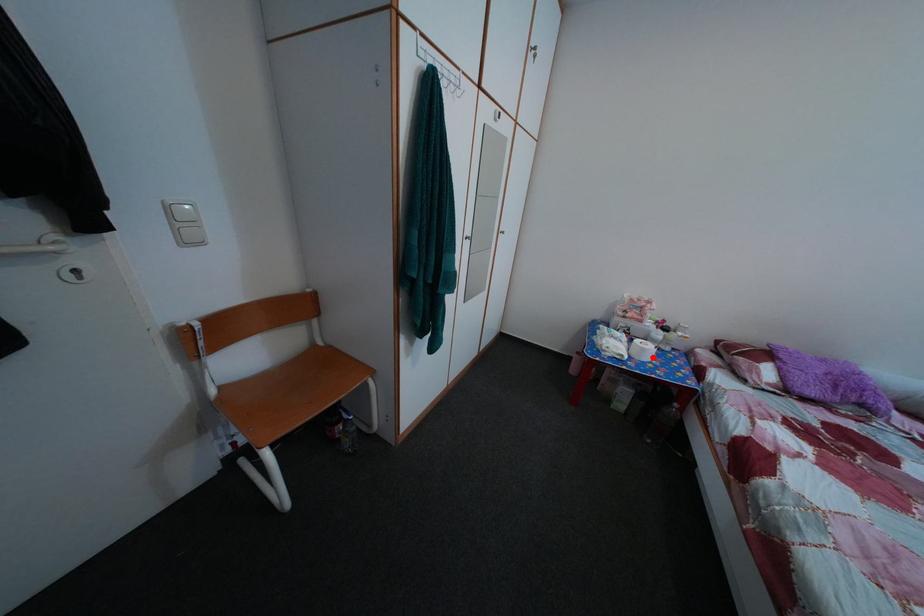
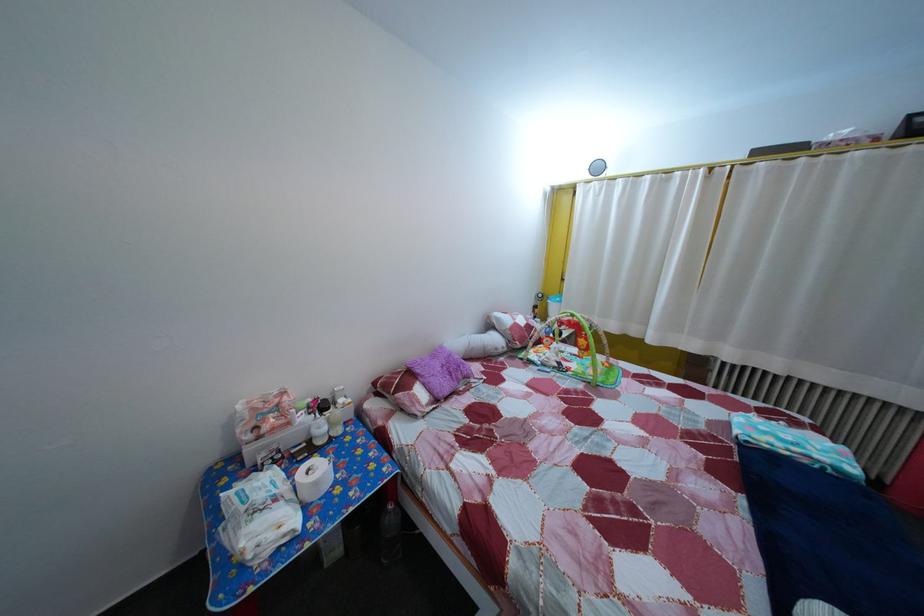
Locate, in the second image, the point that corresponds to the highlighted location in the first image.

(325, 491)